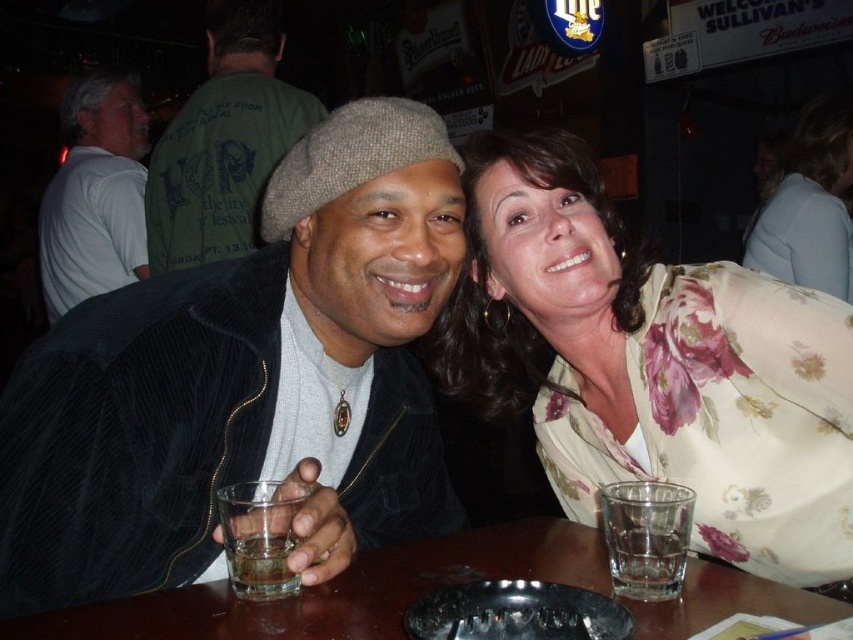
Question: Which object is farther from the camera taking this photo?

Choices:
 (A) corduroy jacket at center
 (B) translucent glass at table
 (C) green corduroy jacket at upper left
 (D) clear glass at table

Answer: (C)

Question: From the image, what is the correct spatial relationship of transparent glass at center in relation to clear glass at table?

Choices:
 (A) below
 (B) above

Answer: (A)

Question: Can you confirm if white cotton shirt at left is positioned to the right of translucent glass at table?

Choices:
 (A) yes
 (B) no

Answer: (B)

Question: Which point is farther to the camera?

Choices:
 (A) (613, 522)
 (B) (358, 260)

Answer: (B)

Question: Where is white cotton shirt at left located in relation to clear glass at table in the image?

Choices:
 (A) left
 (B) right

Answer: (A)

Question: Among these objects, which one is farthest from the camera?

Choices:
 (A) green corduroy jacket at upper left
 (B) transparent glass at center
 (C) corduroy jacket at center

Answer: (A)